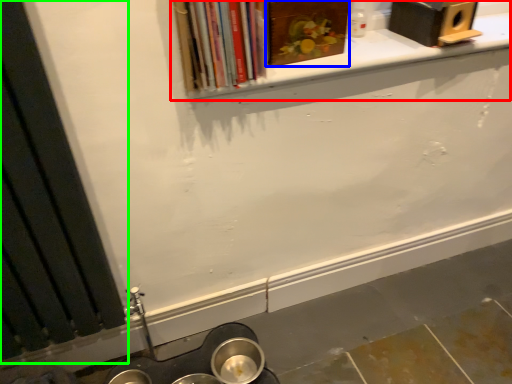
Question: Estimate the real-world distances between objects in this image. Which object is closer to window sill (highlighted by a red box), book (highlighted by a blue box) or window frame (highlighted by a green box)?

Choices:
 (A) book
 (B) window frame

Answer: (A)